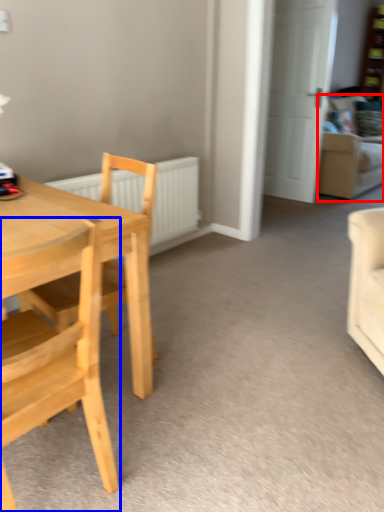
Question: Among these objects, which one is farthest to the camera, couch (highlighted by a red box) or chair (highlighted by a blue box)?

Choices:
 (A) couch
 (B) chair

Answer: (A)